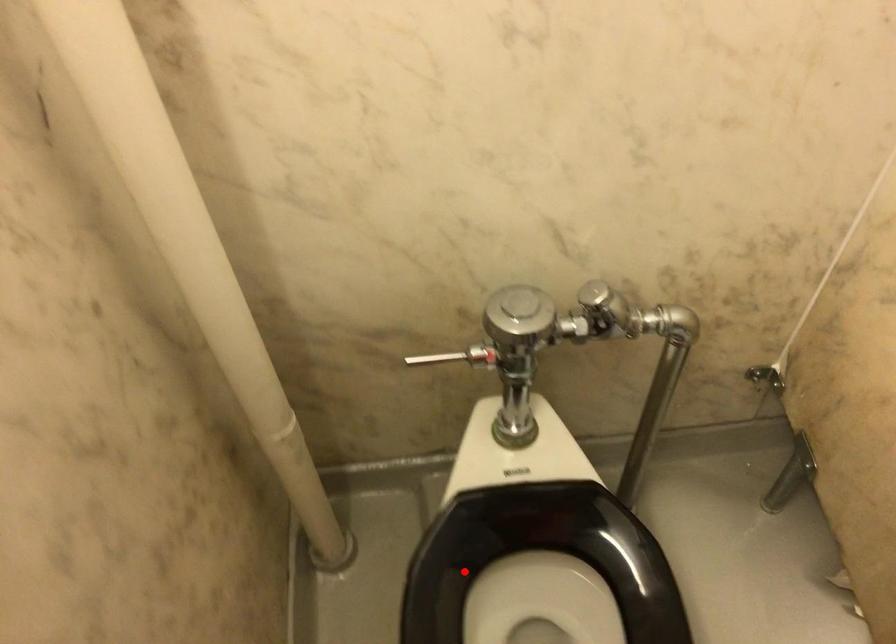
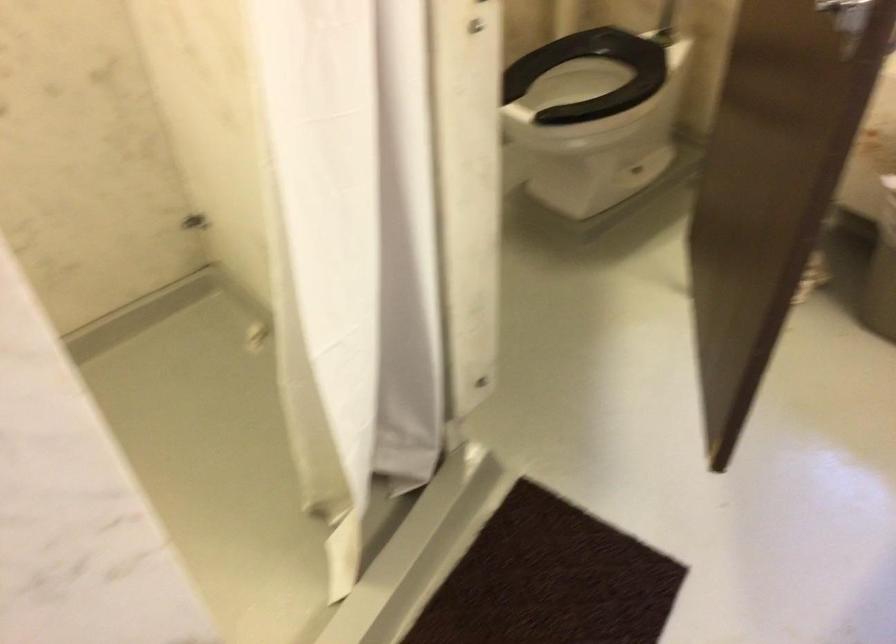
Question: I am providing you with two images of the same scene from different viewpoints. A red point is shown in image1. For the corresponding object point in image2, is it positioned nearer or farther from the camera?

Choices:
 (A) Nearer
 (B) Farther

Answer: (B)